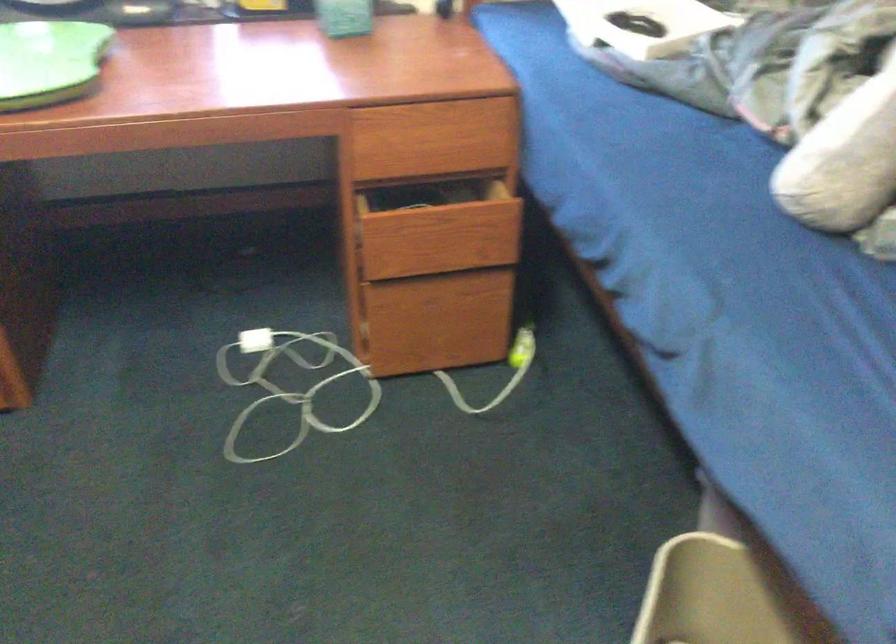
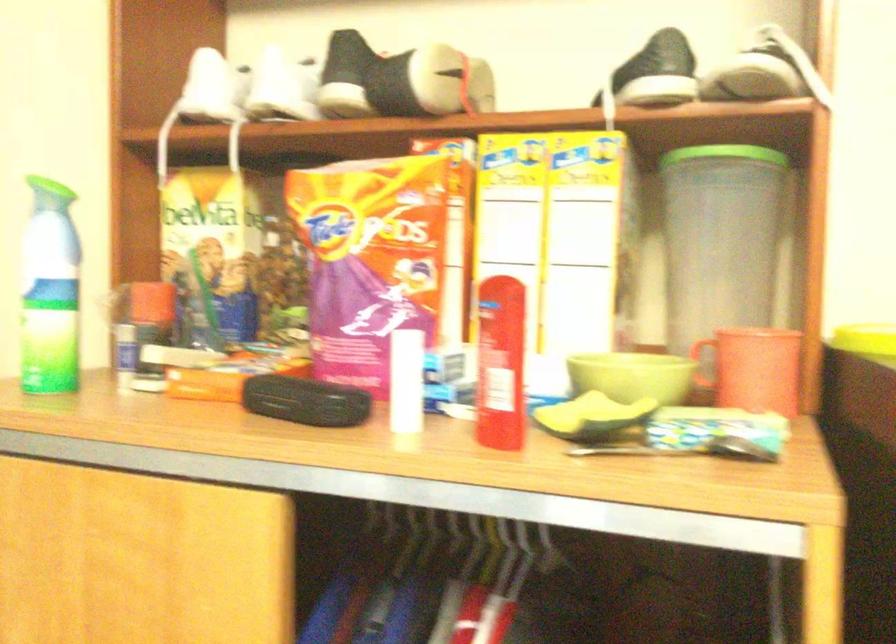
Question: The first image is from the beginning of the video and the second image is from the end. How did the camera likely rotate when shooting the video?

Choices:
 (A) Left
 (B) Right
 (C) Up
 (D) Down

Answer: (B)